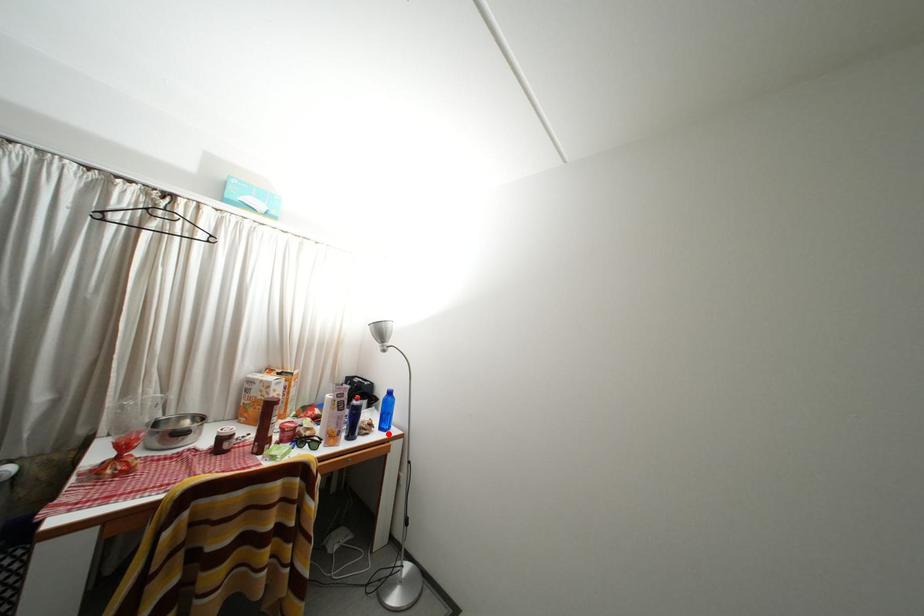
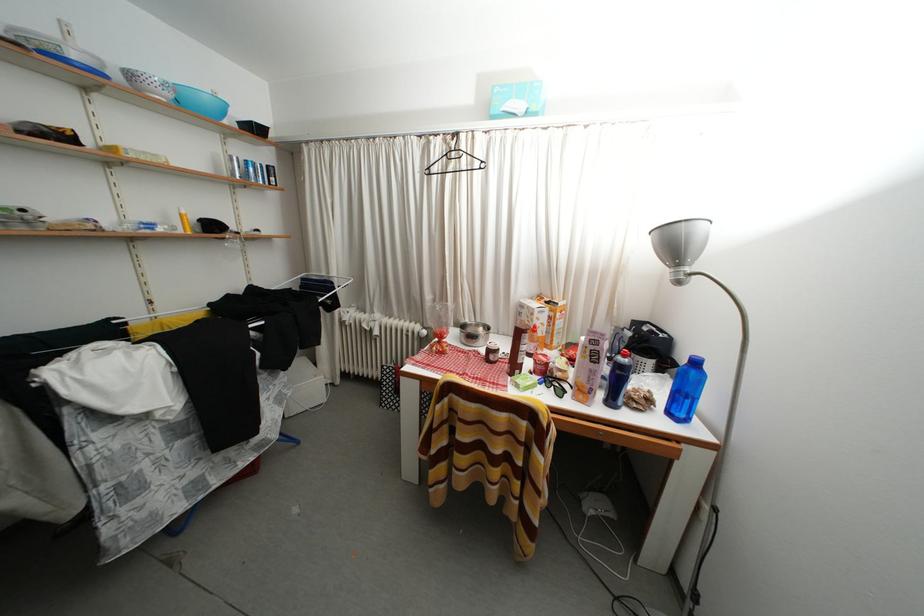
The point at the highlighted location is marked in the first image. Where is the corresponding point in the second image?

(676, 419)